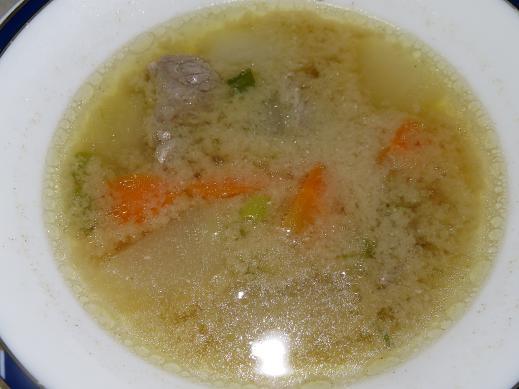
Where is `edge of bowl`? This screenshot has width=519, height=389. edge of bowl is located at coordinates (16, 377).